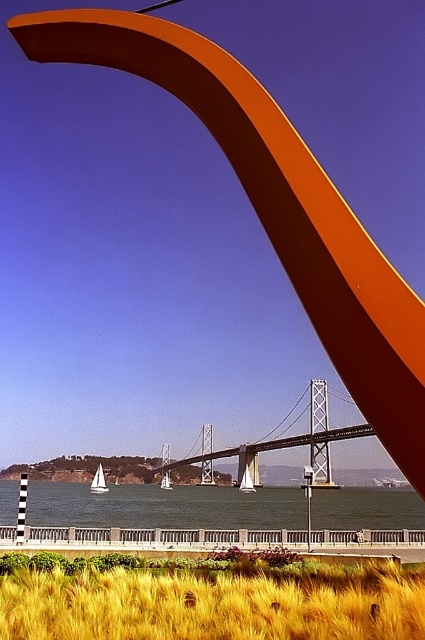
Question: Does golden wheat field at lower center appear under blue water at center?

Choices:
 (A) no
 (B) yes

Answer: (A)

Question: Estimate the real-world distances between objects in this image. Which object is farther from the golden wheat field at lower center?

Choices:
 (A) blue water at center
 (B) metallic gray bridge at center

Answer: (B)

Question: Which object appears closest to the camera in this image?

Choices:
 (A) blue water at center
 (B) metallic gray bridge at center

Answer: (A)

Question: Which object is the closest to the metallic gray bridge at center?

Choices:
 (A) blue water at center
 (B) golden wheat field at lower center

Answer: (A)

Question: Can you confirm if golden wheat field at lower center is thinner than blue water at center?

Choices:
 (A) yes
 (B) no

Answer: (A)

Question: Is golden wheat field at lower center below blue water at center?

Choices:
 (A) yes
 (B) no

Answer: (B)